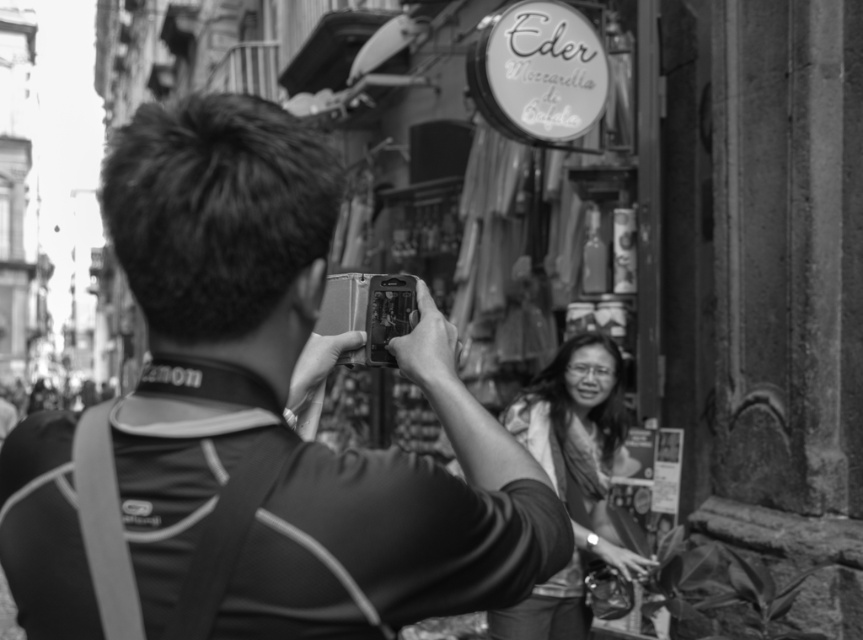
Question: Which point is farther to the camera?

Choices:
 (A) smooth fabric blouse at center
 (B) matte black camera at center

Answer: (A)

Question: Observing the image, what is the correct spatial positioning of matte black camera at center in reference to smooth fabric blouse at center?

Choices:
 (A) left
 (B) right

Answer: (A)

Question: Which point is farther to the camera?

Choices:
 (A) matte black camera at center
 (B) smooth fabric blouse at center

Answer: (B)

Question: Does matte black camera at center have a greater width compared to smooth fabric blouse at center?

Choices:
 (A) no
 (B) yes

Answer: (B)

Question: Does matte black camera at center lie behind smooth fabric blouse at center?

Choices:
 (A) yes
 (B) no

Answer: (B)